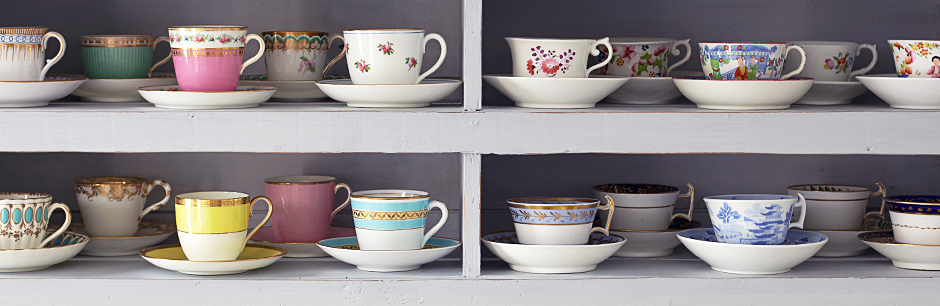
The height and width of the screenshot is (306, 940). In order to click on angular handle in this screenshot , I will do `click(612, 209)`, `click(690, 194)`, `click(802, 200)`, `click(882, 191)`.